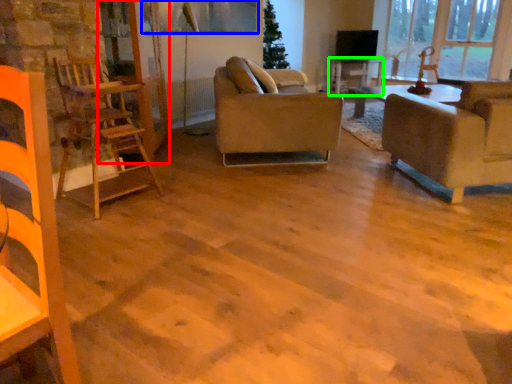
Question: Estimate the real-world distances between objects in this image. Which object is closer to glass door (highlighted by a red box), window screen (highlighted by a blue box) or table (highlighted by a green box)?

Choices:
 (A) window screen
 (B) table

Answer: (A)